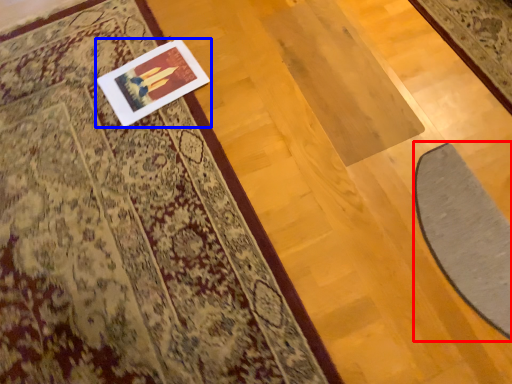
Question: Which object appears farthest to the camera in this image, doormat (highlighted by a red box) or picture frame (highlighted by a blue box)?

Choices:
 (A) doormat
 (B) picture frame

Answer: (B)